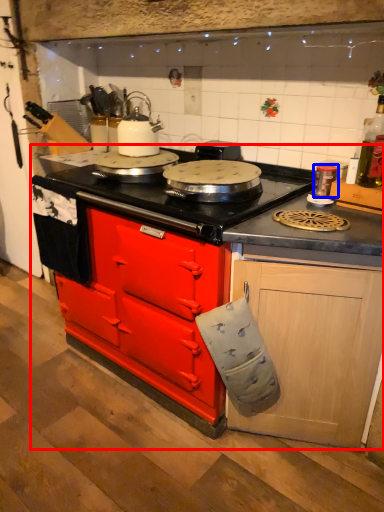
Question: Which of the following is the closest to the observer, countertop (highlighted by a red box) or kitchen appliance (highlighted by a blue box)?

Choices:
 (A) countertop
 (B) kitchen appliance

Answer: (A)